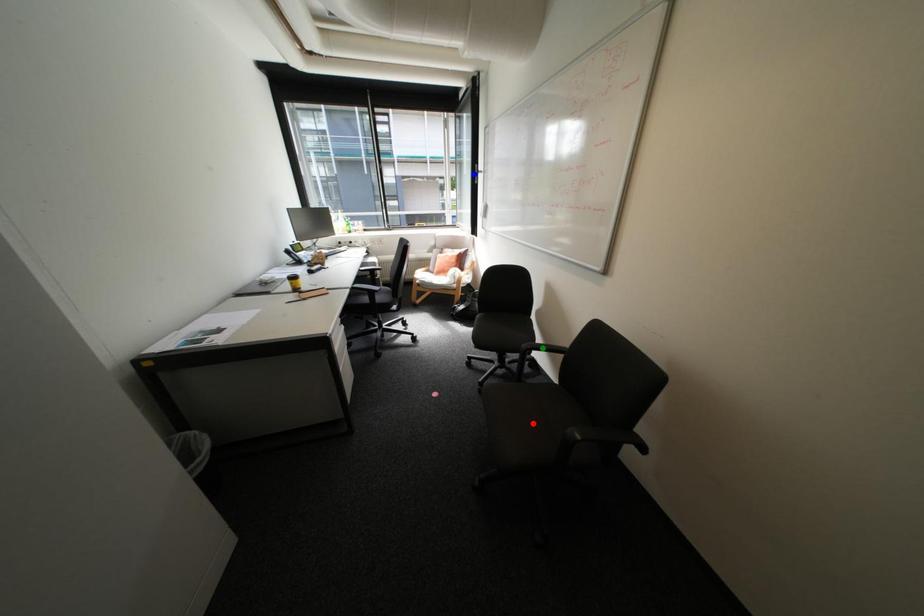
Order these from nearest to farthest:
1. green point
2. blue point
3. red point

green point < red point < blue point